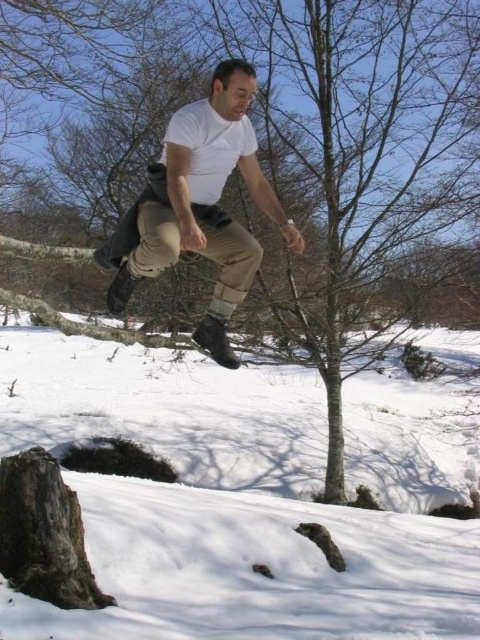
Question: Is white powdery snow at lower center positioned at the back of white matte t-shirt at center?

Choices:
 (A) yes
 (B) no

Answer: (B)

Question: Which of the following is the closest to the observer?

Choices:
 (A) click(x=456, y=612)
 (B) click(x=152, y=253)

Answer: (B)

Question: Does white matte t-shirt at center come behind khaki pants at center?

Choices:
 (A) no
 (B) yes

Answer: (A)

Question: Which of the following is the closest to the observer?

Choices:
 (A) white powdery snow at lower center
 (B) white matte t-shirt at center

Answer: (A)

Question: Which of these objects is positioned closest to the white matte t-shirt at center?

Choices:
 (A) white powdery snow at lower center
 (B) khaki pants at center

Answer: (B)

Question: Can you confirm if white powdery snow at lower center is bigger than white matte t-shirt at center?

Choices:
 (A) no
 (B) yes

Answer: (B)